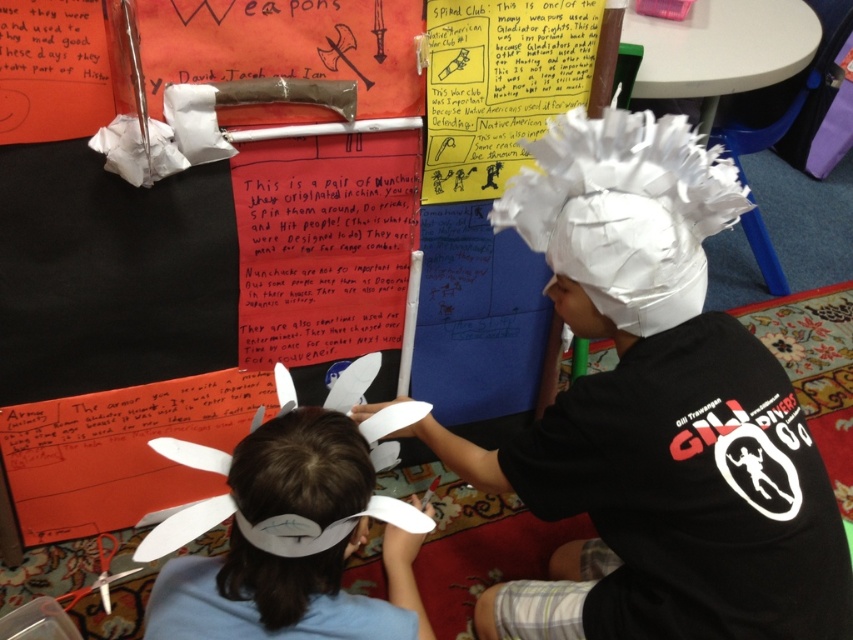
You are a teacher in the classroom. You need to place a new poster between the white paper hat at upper center and the white paper hat at lower left. What is the minimum width of the poster required to fit between them?

The white paper hat at upper center is 14.13 inches away from the white paper hat at lower left, so the poster needs to be at least 14.13 inches wide to fit between them.